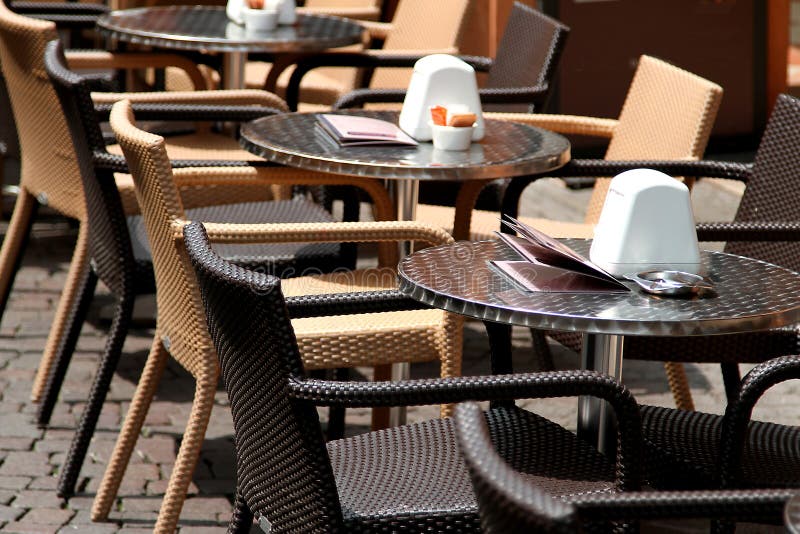
At what (x,y) coordinates should I click in order to perform the action: click on visible chair legs. Please return your answer as a coordinate pair (x, y). The width and height of the screenshot is (800, 534). Looking at the image, I should click on (10, 256), (54, 321), (69, 329), (113, 348), (148, 389), (194, 424), (240, 519), (680, 394), (730, 376).